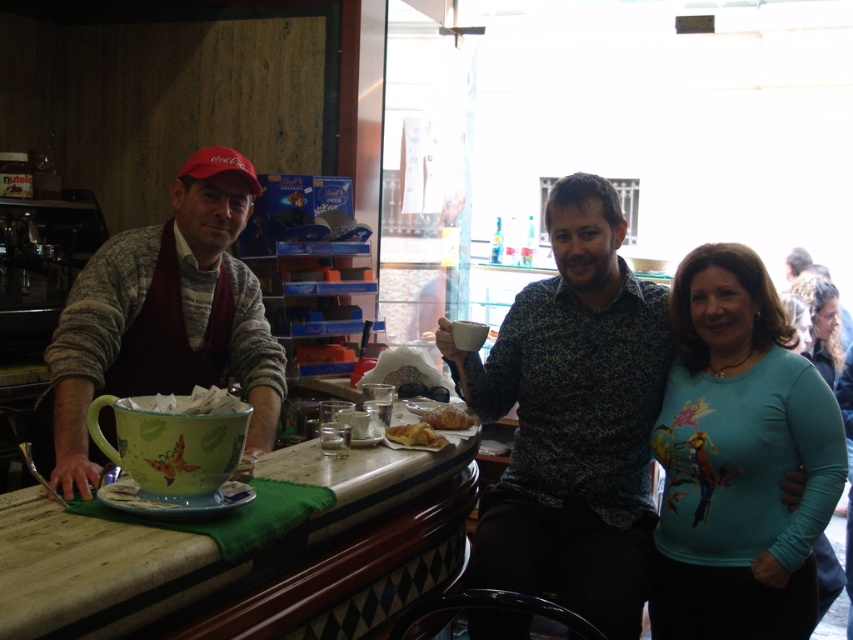
Question: Which point is farther to the camera?

Choices:
 (A) golden crispy pastry at center
 (B) green fabric-covered table at center

Answer: (A)

Question: Does matte green ceramic mug at left have a larger size compared to golden crispy pastry at center?

Choices:
 (A) no
 (B) yes

Answer: (B)

Question: Which object is positioned closest to the floral-patterned shirt at center?

Choices:
 (A) golden crispy pastry at center
 (B) green fabric-covered table at center
 (C) teal matte shirt at center

Answer: (C)

Question: Which of the following is the closest to the observer?

Choices:
 (A) matte green ceramic mug at left
 (B) teal matte shirt at center
 (C) golden crispy pastry at center

Answer: (A)

Question: Observing the image, what is the correct spatial positioning of matte green ceramic mug at left in reference to golden crispy pastry at center?

Choices:
 (A) left
 (B) right

Answer: (A)

Question: Is the position of floral-patterned shirt at center more distant than that of teal matte shirt at center?

Choices:
 (A) no
 (B) yes

Answer: (A)